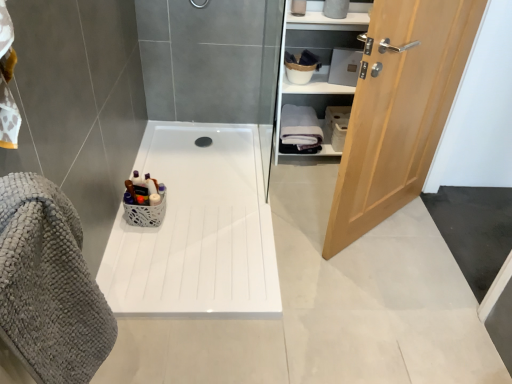
Find the location of a particular element. vacant space situated on the left part of black rubber drain at center is located at coordinates (178, 135).